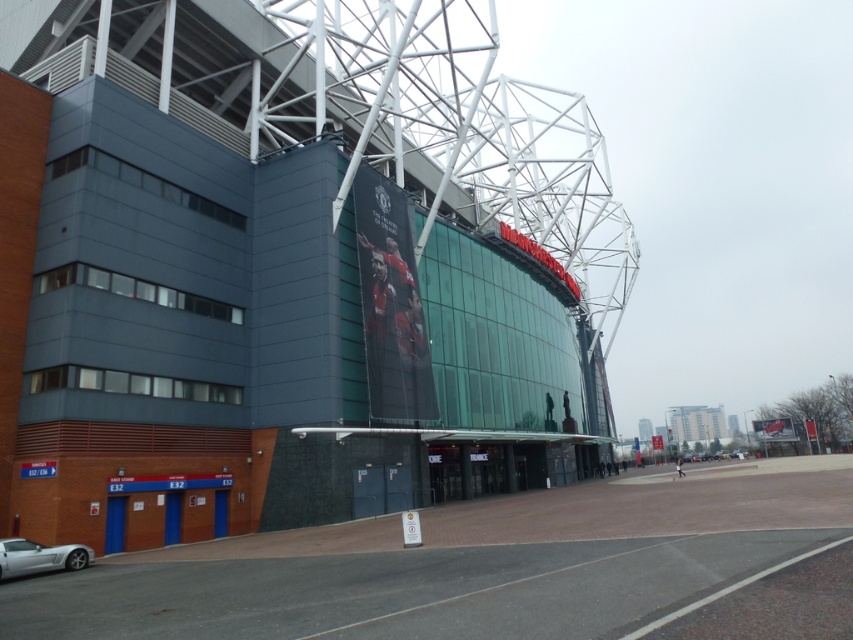
Question: Can you confirm if dark gray concrete stadium at center is thinner than silver metallic car at lower left?

Choices:
 (A) yes
 (B) no

Answer: (B)

Question: Is dark gray concrete stadium at center closer to camera compared to silver metallic car at lower left?

Choices:
 (A) no
 (B) yes

Answer: (A)

Question: Among these points, which one is farthest from the camera?

Choices:
 (A) (213, 349)
 (B) (68, 545)

Answer: (A)

Question: Does dark gray concrete stadium at center have a lesser width compared to silver metallic car at lower left?

Choices:
 (A) yes
 (B) no

Answer: (B)

Question: Among these points, which one is farthest from the camera?

Choices:
 (A) (22, 572)
 (B) (349, 412)

Answer: (B)